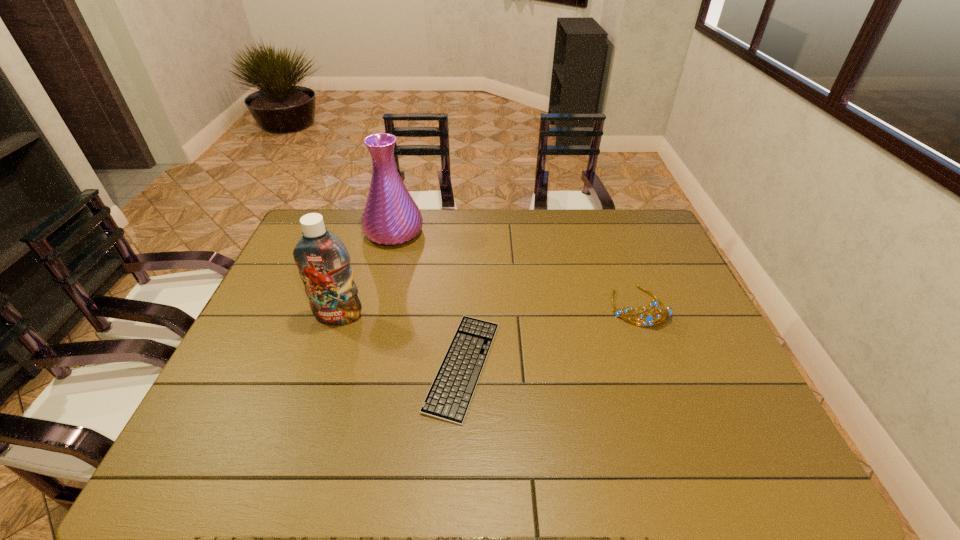
Where is `free space between the shampoo and the rightmost object`? This screenshot has width=960, height=540. free space between the shampoo and the rightmost object is located at coordinates (489, 312).

Where is `vacant space that's between the shampoo and the vase`? This screenshot has height=540, width=960. vacant space that's between the shampoo and the vase is located at coordinates (367, 274).

Image resolution: width=960 pixels, height=540 pixels. What are the coordinates of `empty space that is in between the shampoo and the shortest object` in the screenshot? It's located at (401, 341).

You are a GUI agent. You are given a task and a screenshot of the screen. Output one action in this format:
    pyautogui.click(x=<x>, y=<y>)
    Task: Click on the free space that is in between the third tallest object and the shampoo
    This screenshot has width=960, height=540.
    Given the screenshot: What is the action you would take?
    pyautogui.click(x=489, y=312)

This screenshot has height=540, width=960. I want to click on unoccupied position between the shampoo and the vase, so click(x=367, y=274).

You are a GUI agent. You are given a task and a screenshot of the screen. Output one action in this format:
    pyautogui.click(x=<x>, y=<y>)
    Task: Click on the free space between the third object from left to right and the shampoo
    This screenshot has height=540, width=960.
    Given the screenshot: What is the action you would take?
    pyautogui.click(x=401, y=341)

Select which object is the third closest to the shampoo. Please provide its 2D coordinates. Your answer should be formatted as a tuple, i.e. [(x, y)], where the tuple contains the x and y coordinates of a point satisfying the conditions above.

[(648, 319)]

Identify which object is located as the nearest to the vase. Please provide its 2D coordinates. Your answer should be formatted as a tuple, i.e. [(x, y)], where the tuple contains the x and y coordinates of a point satisfying the conditions above.

[(323, 261)]

Identify the location of free space that satisfies the following two spatial constraints: 1. on the front label of the shampoo; 2. on the left side of the second object from right to left. (323, 366).